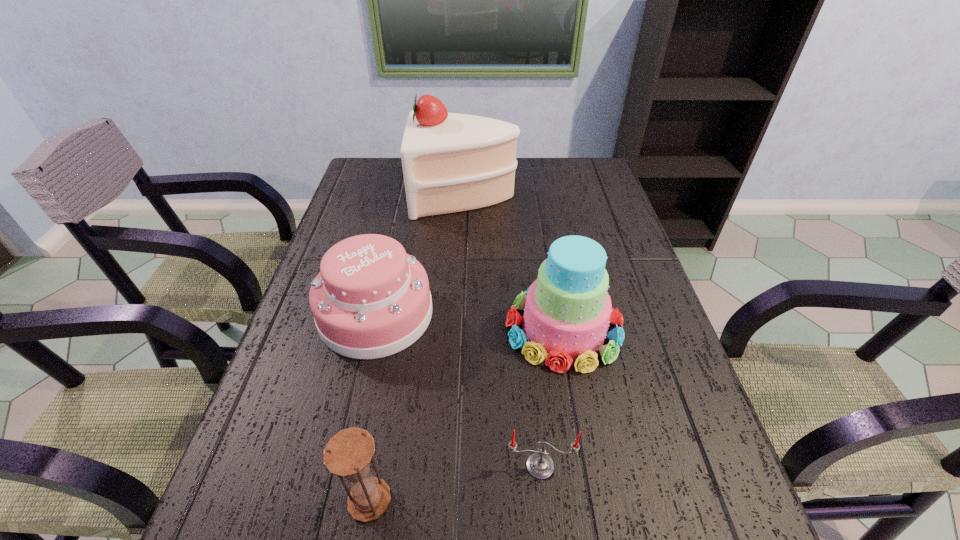
Where is `free region located 0.090m on the front-facing side of the shortest object`? free region located 0.090m on the front-facing side of the shortest object is located at coordinates (547, 537).

Locate an element on the screen. object that is at the far edge is located at coordinates (452, 162).

Locate an element on the screen. This screenshot has width=960, height=540. object that is positioned at the left edge is located at coordinates (370, 300).

Find the location of a particular element. This screenshot has height=540, width=960. object located at the right edge is located at coordinates (567, 310).

I want to click on vacant space at the left edge of the desktop, so click(x=245, y=492).

This screenshot has width=960, height=540. I want to click on free space at the right edge of the desktop, so click(x=676, y=349).

This screenshot has height=540, width=960. Identify the location of vacant space at the near left corner of the desktop. (272, 537).

In order to click on free space between the shortest cake and the tallest object in this screenshot , I will do `click(420, 255)`.

Where is `free space between the shortest object and the shortest cake`? free space between the shortest object and the shortest cake is located at coordinates (458, 390).

At what (x,y) coordinates should I click in order to perform the action: click on free spot between the shortest object and the fourth shortest object. Please return your answer as a coordinate pair (x, y). Image resolution: width=960 pixels, height=540 pixels. Looking at the image, I should click on coord(552,397).